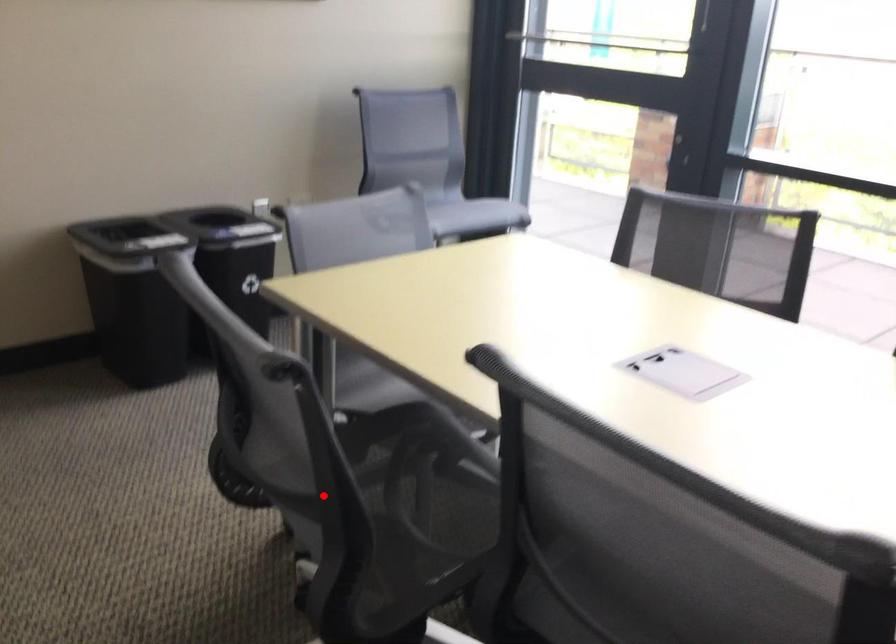
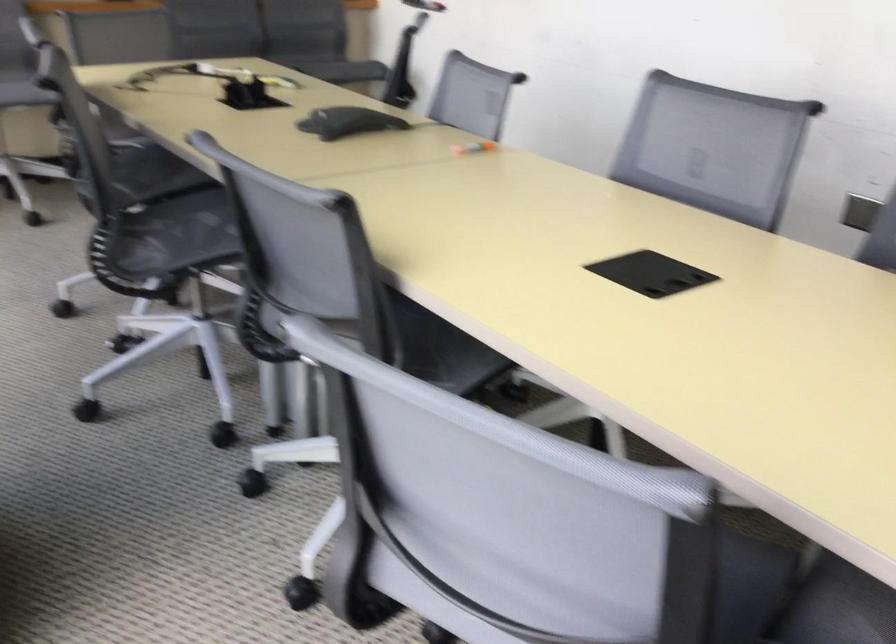
Question: I am providing you with two images of the same scene from different viewpoints. Image1 has a red point marked. In image2, the corresponding 3D location appears at what relative position? Reply with the corresponding letter.

Choices:
 (A) Closer
 (B) Farther

Answer: (B)